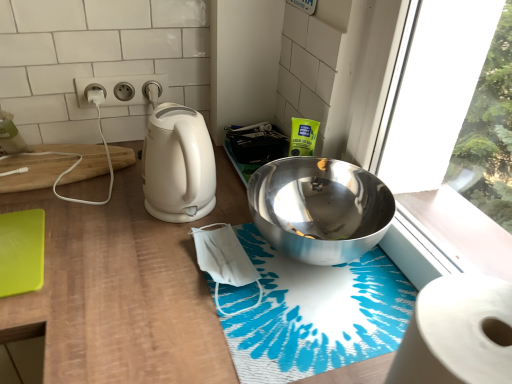
Identify the location of free location above white paper at lower right (from a real-world perspective). This screenshot has width=512, height=384. (472, 318).